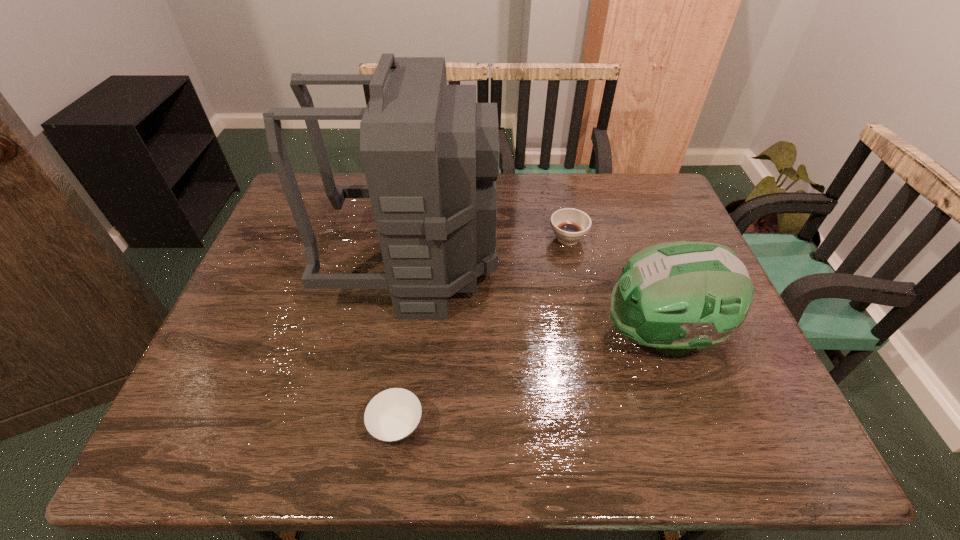
The image size is (960, 540). I want to click on vacant region that satisfies the following two spatial constraints: 1. on the front compartment of the tallest object; 2. on the right side of the nearer soup bowl, so click(x=392, y=428).